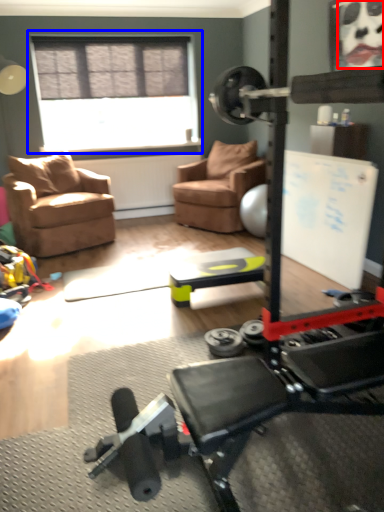
Question: Which point is closer to the camera, face (highlighted by a red box) or window (highlighted by a blue box)?

Choices:
 (A) face
 (B) window

Answer: (A)